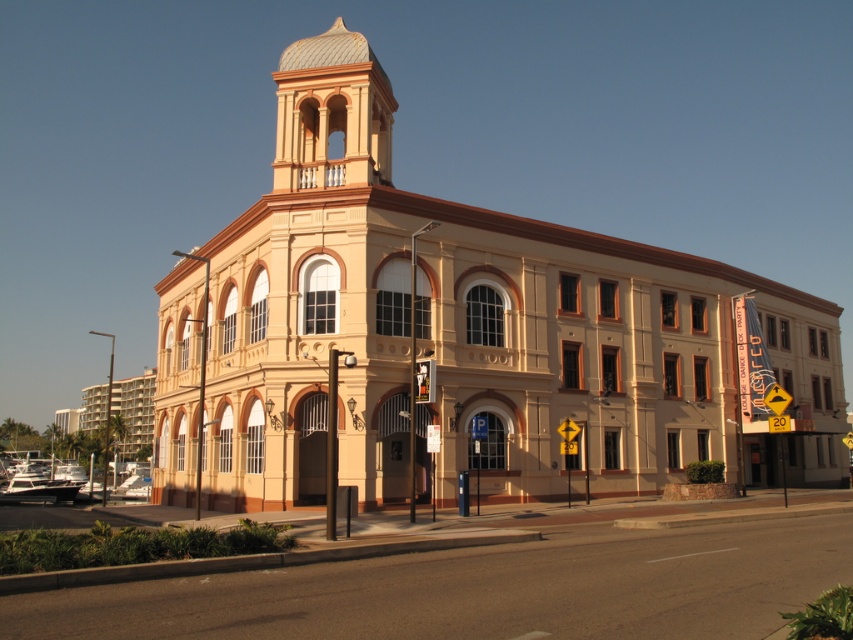
You are standing in front of the beige stone church at center and the smooth cream stucco bell tower at upper center. Which one is more to the right?

The beige stone church at center is positioned on the right side of smooth cream stucco bell tower at upper center, so the beige stone church at center is more to the right.

You are an architect analyzing the building shown. You need to determine which structure is taller between the beige stone church at center and the smooth cream stucco bell tower at upper center. Based on the image, which one is taller?

The smooth cream stucco bell tower at upper center is taller than the beige stone church at center according to the description.

You are standing in front of the building and want to determine the spatial relationship between two specific points on the facade. The first point is at coordinate point (331,371), and the second is at point (363,170). Which of these two points is nearer to your current position?

Point (331,371) is closer to the viewer than point (363,170).